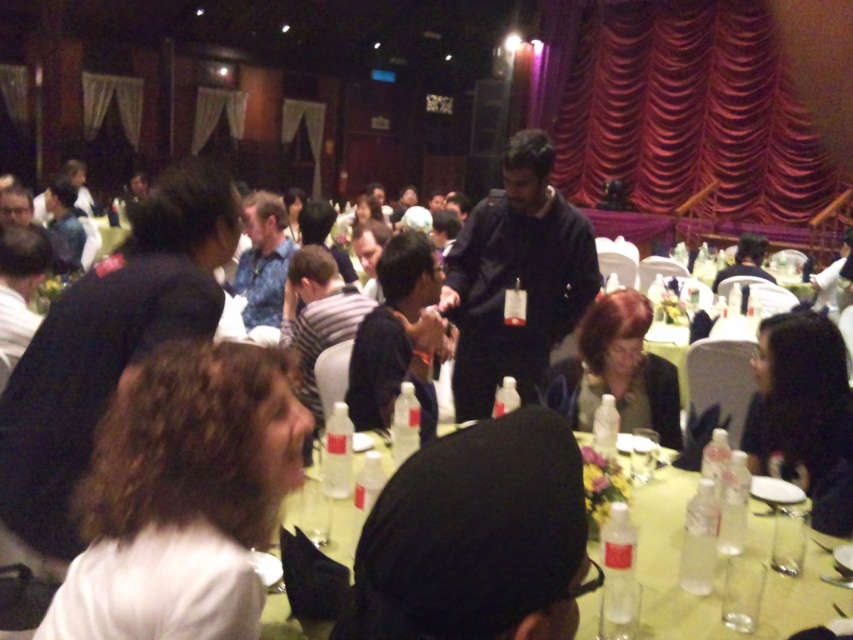
Can you confirm if black matte jacket at center is wider than matte black jacket at center?

Yes.

Is black matte jacket at center to the right of matte black jacket at center from the viewer's perspective?

No, black matte jacket at center is not to the right of matte black jacket at center.

Where is `black matte jacket at center`? This screenshot has height=640, width=853. black matte jacket at center is located at coordinates (515, 278).

The height and width of the screenshot is (640, 853). What are the coordinates of `black matte jacket at center` in the screenshot? It's located at (515, 278).

Does red velvet curtain at upper right appear under black matte jacket at center?

Actually, red velvet curtain at upper right is above black matte jacket at center.

Describe the element at coordinates (677, 108) in the screenshot. I see `red velvet curtain at upper right` at that location.

Between point (567, 51) and point (569, 321), which one is positioned in front?

Point (569, 321) is in front.

Locate an element on the screen. red velvet curtain at upper right is located at coordinates (677, 108).

Can you confirm if black matte shirt at center is bigger than matte black jacket at center?

Correct, black matte shirt at center is larger in size than matte black jacket at center.

Is black matte shirt at center smaller than matte black jacket at center?

No.

The image size is (853, 640). I want to click on black matte shirt at center, so click(398, 337).

Locate an element on the screen. black matte shirt at center is located at coordinates (398, 337).